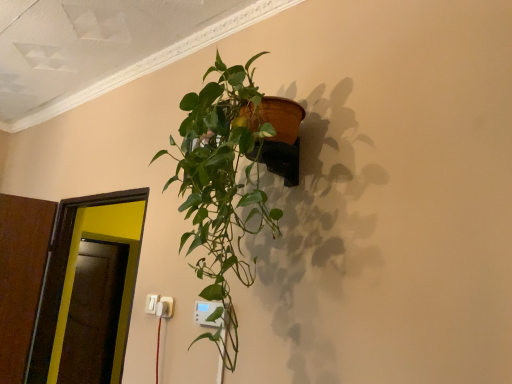
What is the approximate height of transparent glass door at left?

The height of transparent glass door at left is 1.04 meters.

What do you see at coordinates (168, 306) in the screenshot?
I see `white plastic electric outlet at lower center, positioned as the 2th electric outlet in left-to-right order` at bounding box center [168, 306].

Looking at this image, measure the distance between point (170, 303) and camera.

Point (170, 303) and camera are 5.60 feet apart.

Find the location of a particular element. green glossy plant at upper center is located at coordinates (222, 187).

Locate an element on the screen. transparent glass door at left is located at coordinates (74, 272).

Between white plastic electric outlet at lower center, positioned as the 2th electric outlet in left-to-right order, and white plastic electric outlet at lower center, acting as the 3th electric outlet starting from the back, which one has smaller size?

white plastic electric outlet at lower center, positioned as the 2th electric outlet in left-to-right order, is smaller.

Looking at this image, between white plastic electric outlet at lower center, which is the 2th electric outlet in front-to-back order, and white plastic electric outlet at lower center, which is the 1th electric outlet from right to left, which one has larger width?

Wider between the two is white plastic electric outlet at lower center, which is the 1th electric outlet from right to left.

Does white plastic electric outlet at lower center, the second electric outlet from the back, turn towards white plastic electric outlet at lower center, acting as the 3th electric outlet starting from the left?

No, white plastic electric outlet at lower center, the second electric outlet from the back, is not turned towards white plastic electric outlet at lower center, acting as the 3th electric outlet starting from the left.

Is white plastic electric outlet at lower center, the second electric outlet in the right-to-left sequence, further to camera compared to white plastic electric outlet at lower center, the first electric outlet when ordered from front to back?

Yes, it is behind white plastic electric outlet at lower center, the first electric outlet when ordered from front to back.

How much distance is there between green glossy plant at upper center and transparent glass door at left?

green glossy plant at upper center is 32.28 inches from transparent glass door at left.

Considering the positions of objects green glossy plant at upper center and transparent glass door at left in the image provided, who is more to the right, green glossy plant at upper center or transparent glass door at left?

From the viewer's perspective, green glossy plant at upper center appears more on the right side.

Locate an element on the screen. The image size is (512, 384). glass door behind the green glossy plant at upper center is located at coordinates (74, 272).

In the scene shown: Is green glossy plant at upper center not close to transparent glass door at left?

No, green glossy plant at upper center is not far from transparent glass door at left.

Based on the photo, how different are the orientations of white plastic electric outlet at lower center, which is the 1th electric outlet from right to left, and white plastic electric outlet at lower center, positioned as the 2th electric outlet in left-to-right order, in degrees?

The angle between the facing direction of white plastic electric outlet at lower center, which is the 1th electric outlet from right to left, and the facing direction of white plastic electric outlet at lower center, positioned as the 2th electric outlet in left-to-right order, is 1.86 degrees.

From the image's perspective, is white plastic electric outlet at lower center, acting as the 3th electric outlet starting from the back, under white plastic electric outlet at lower center, which is the 2th electric outlet in front-to-back order?

Incorrect, from the image's perspective, white plastic electric outlet at lower center, acting as the 3th electric outlet starting from the back, is higher than white plastic electric outlet at lower center, which is the 2th electric outlet in front-to-back order.

Where is `electric outlet below the white plastic electric outlet at lower center, the second electric outlet from the back (from a real-world perspective)`? The image size is (512, 384). electric outlet below the white plastic electric outlet at lower center, the second electric outlet from the back (from a real-world perspective) is located at coordinates (207, 313).

Is white plastic electric outlet at lower center, which is the 1th electric outlet from right to left, at the right side of white plastic electric outlet at lower center, the second electric outlet from the back?

Yes, white plastic electric outlet at lower center, which is the 1th electric outlet from right to left, is to the right of white plastic electric outlet at lower center, the second electric outlet from the back.

Which object is more forward, white plastic electric outlet at lower center, positioned as the 2th electric outlet in left-to-right order, or green glossy plant at upper center?

green glossy plant at upper center is in front.

Can you tell me how much white plastic electric outlet at lower center, the second electric outlet in the right-to-left sequence, and green glossy plant at upper center differ in facing direction?

The facing directions of white plastic electric outlet at lower center, the second electric outlet in the right-to-left sequence, and green glossy plant at upper center are 0.747 degrees apart.

Considering the sizes of objects white plastic electric outlet at lower center, positioned as the 2th electric outlet in left-to-right order, and green glossy plant at upper center in the image provided, who is wider, white plastic electric outlet at lower center, positioned as the 2th electric outlet in left-to-right order, or green glossy plant at upper center?

green glossy plant at upper center.

From the image's perspective, between white plastic electric outlet at lower center, the second electric outlet from the back, and green glossy plant at upper center, which one is located above?

green glossy plant at upper center, from the image's perspective.

Can you confirm if green glossy plant at upper center is positioned to the left of white plastic electric outlet at lower center, positioned as the 2th electric outlet in left-to-right order?

Incorrect, green glossy plant at upper center is not on the left side of white plastic electric outlet at lower center, positioned as the 2th electric outlet in left-to-right order.

Between green glossy plant at upper center and white plastic electric outlet at lower center, the second electric outlet from the back, which one has larger size?

With larger size is green glossy plant at upper center.

Which electric outlet is the 2nd one when counting from the back of the green glossy plant at upper center? Please provide its 2D coordinates.

[(168, 306)]

Is green glossy plant at upper center spatially inside white plastic electric outlet at lower center, positioned as the 2th electric outlet in left-to-right order, or outside of it?

green glossy plant at upper center lies outside white plastic electric outlet at lower center, positioned as the 2th electric outlet in left-to-right order.

From the image's perspective, which is above, white plastic electric outlet at lower center, positioned as the 2th electric outlet in left-to-right order, or transparent glass door at left?

white plastic electric outlet at lower center, positioned as the 2th electric outlet in left-to-right order.

In terms of width, does white plastic electric outlet at lower center, which is the 2th electric outlet in front-to-back order, look wider or thinner when compared to transparent glass door at left?

In the image, white plastic electric outlet at lower center, which is the 2th electric outlet in front-to-back order, appears to be more narrow than transparent glass door at left.

Considering the positions of objects white plastic electric outlet at lower center, which is the 2th electric outlet in front-to-back order, and transparent glass door at left in the image provided, who is behind, white plastic electric outlet at lower center, which is the 2th electric outlet in front-to-back order, or transparent glass door at left?

transparent glass door at left is behind.

Is white plastic electric outlet at lower center, the second electric outlet in the right-to-left sequence, situated inside transparent glass door at left or outside?

white plastic electric outlet at lower center, the second electric outlet in the right-to-left sequence, cannot be found inside transparent glass door at left.

Is white plastic electric outlet at lower center, acting as the 3th electric outlet starting from the left, positioned beyond the bounds of green glossy plant at upper center?

No, most part of white plastic electric outlet at lower center, acting as the 3th electric outlet starting from the left, lies within green glossy plant at upper center.

You are a GUI agent. You are given a task and a screenshot of the screen. Output one action in this format:
    pyautogui.click(x=<x>, y=<y>)
    Task: Click on the electric outlet that is the 1st object located below the green glossy plant at upper center (from the image's perspective)
    
    Given the screenshot: What is the action you would take?
    pyautogui.click(x=207, y=313)

Which object is positioned more to the left, white plastic electric outlet at lower center, which is the 1th electric outlet from right to left, or green glossy plant at upper center?

white plastic electric outlet at lower center, which is the 1th electric outlet from right to left, is more to the left.

How different are the orientations of white plastic electric outlet at lower center, which is the 1th electric outlet from right to left, and green glossy plant at upper center in degrees?

The facing directions of white plastic electric outlet at lower center, which is the 1th electric outlet from right to left, and green glossy plant at upper center are 1.11 degrees apart.

Image resolution: width=512 pixels, height=384 pixels. Find the location of `the 1st electric outlet positioned above the white plastic electric outlet at lower center, acting as the 3th electric outlet starting from the back (from a real-world perspective)`. the 1st electric outlet positioned above the white plastic electric outlet at lower center, acting as the 3th electric outlet starting from the back (from a real-world perspective) is located at coordinates (168, 306).

You are a GUI agent. You are given a task and a screenshot of the screen. Output one action in this format:
    pyautogui.click(x=<x>, y=<y>)
    Task: Click on the houseplant on the right of transparent glass door at left
    
    Given the screenshot: What is the action you would take?
    tap(222, 187)

Looking at the image, which one is located closer to green glossy plant at upper center, transparent glass door at left or white plastic electric outlet at lower center, the first electric outlet when ordered from front to back?

white plastic electric outlet at lower center, the first electric outlet when ordered from front to back, lies closer to green glossy plant at upper center than the other object.

Looking at the image, which one is located further to white plastic electric outlet at lower center, the first electric outlet when ordered from front to back, green glossy plant at upper center or transparent glass door at left?

The object further to white plastic electric outlet at lower center, the first electric outlet when ordered from front to back, is transparent glass door at left.

Which object lies further to the anchor point green glossy plant at upper center, white plastic electric outlet at lower left, positioned as the first electric outlet in back-to-front order, or white plastic electric outlet at lower center, acting as the 3th electric outlet starting from the back?

white plastic electric outlet at lower left, positioned as the first electric outlet in back-to-front order, is positioned further to the anchor green glossy plant at upper center.

When comparing their distances from transparent glass door at left, does white plastic electric outlet at lower left, the third electric outlet positioned from the front, or green glossy plant at upper center seem further?

The object further to transparent glass door at left is green glossy plant at upper center.

When comparing their distances from transparent glass door at left, does white plastic electric outlet at lower center, which is the 1th electric outlet from right to left, or white plastic electric outlet at lower center, the second electric outlet from the back, seem further?

The object further to transparent glass door at left is white plastic electric outlet at lower center, which is the 1th electric outlet from right to left.

Based on their spatial positions, is transparent glass door at left or white plastic electric outlet at lower center, which is the 2th electric outlet in front-to-back order, further from white plastic electric outlet at lower left, the third electric outlet positioned from the front?

Based on the image, transparent glass door at left appears to be further to white plastic electric outlet at lower left, the third electric outlet positioned from the front.

Estimate the real-world distances between objects in this image. Which object is further from green glossy plant at upper center, white plastic electric outlet at lower center, which is the 2th electric outlet in front-to-back order, or white plastic electric outlet at lower left, the third electric outlet positioned from the front?

white plastic electric outlet at lower left, the third electric outlet positioned from the front, is further to green glossy plant at upper center.

Looking at the image, which one is located closer to white plastic electric outlet at lower center, acting as the 3th electric outlet starting from the back, transparent glass door at left or green glossy plant at upper center?

Based on the image, green glossy plant at upper center appears to be nearer to white plastic electric outlet at lower center, acting as the 3th electric outlet starting from the back.

Find the location of a particular element. This screenshot has width=512, height=384. electric outlet between transparent glass door at left and white plastic electric outlet at lower center, the second electric outlet in the right-to-left sequence is located at coordinates (151, 303).

Locate an element on the screen. This screenshot has height=384, width=512. electric outlet between white plastic electric outlet at lower left, positioned as the first electric outlet in back-to-front order, and white plastic electric outlet at lower center, acting as the 3th electric outlet starting from the left is located at coordinates (168, 306).

Find the location of `electric outlet positioned between green glossy plant at upper center and white plastic electric outlet at lower center, which is the 2th electric outlet in front-to-back order, from near to far`. electric outlet positioned between green glossy plant at upper center and white plastic electric outlet at lower center, which is the 2th electric outlet in front-to-back order, from near to far is located at coordinates (207, 313).